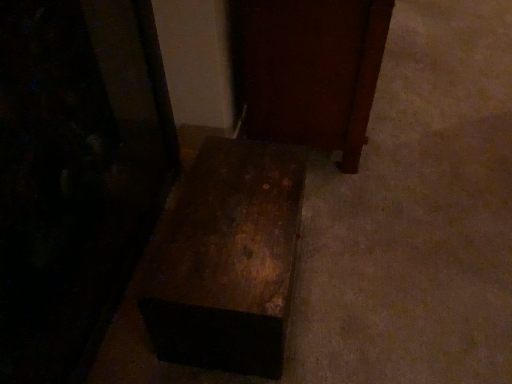
You are a GUI agent. You are given a task and a screenshot of the screen. Output one action in this format:
    pyautogui.click(x=<x>, y=<y>)
    Task: Click on the rusty wood trunk at center, arranged as the second furniture when viewed from the right
    This screenshot has width=512, height=384.
    Given the screenshot: What is the action you would take?
    pyautogui.click(x=227, y=260)

From the picture: Measure the distance between point (210, 346) and camera.

3.39 feet.

I want to click on dark wood door at center, which appears as the 3th furniture when viewed from the left, so click(x=312, y=71).

Measure the distance between rusty metal box at lower center, the 1th furniture from the left, and camera.

rusty metal box at lower center, the 1th furniture from the left, and camera are 3.44 feet apart from each other.

Find the location of `rusty wood trunk at center, placed as the second furniture when sorted from left to right`. rusty wood trunk at center, placed as the second furniture when sorted from left to right is located at coordinates 227,260.

How different are the orientations of rusty wood trunk at center, arranged as the second furniture when viewed from the right, and dark wood door at center, which appears as the 3th furniture when viewed from the left, in degrees?

0.917 degrees separate the facing orientations of rusty wood trunk at center, arranged as the second furniture when viewed from the right, and dark wood door at center, which appears as the 3th furniture when viewed from the left.

In the scene shown: Does rusty wood trunk at center, arranged as the second furniture when viewed from the right, appear on the left side of dark wood door at center, marked as the 1th furniture in a right-to-left arrangement?

Correct, you'll find rusty wood trunk at center, arranged as the second furniture when viewed from the right, to the left of dark wood door at center, marked as the 1th furniture in a right-to-left arrangement.

Does rusty wood trunk at center, arranged as the second furniture when viewed from the right, have a lesser width compared to dark wood door at center, which appears as the 3th furniture when viewed from the left?

Indeed, rusty wood trunk at center, arranged as the second furniture when viewed from the right, has a lesser width compared to dark wood door at center, which appears as the 3th furniture when viewed from the left.

In terms of size, does rusty wood trunk at center, arranged as the second furniture when viewed from the right, appear bigger or smaller than dark wood door at center, marked as the 1th furniture in a right-to-left arrangement?

In the image, rusty wood trunk at center, arranged as the second furniture when viewed from the right, appears to be smaller than dark wood door at center, marked as the 1th furniture in a right-to-left arrangement.

Is rusty metal box at lower center, the 1th furniture from the left, at the right side of dark wood door at center, which appears as the 3th furniture when viewed from the left?

No, rusty metal box at lower center, the 1th furniture from the left, is not to the right of dark wood door at center, which appears as the 3th furniture when viewed from the left.

Is rusty metal box at lower center, the third furniture in the right-to-left sequence, not inside dark wood door at center, which appears as the 3th furniture when viewed from the left?

Yes, rusty metal box at lower center, the third furniture in the right-to-left sequence, is not within dark wood door at center, which appears as the 3th furniture when viewed from the left.

Which is in front, point (7, 277) or point (364, 80)?

The point (7, 277) is closer to the camera.

From the image's perspective, is rusty metal box at lower center, the third furniture in the right-to-left sequence, located above or below dark wood door at center, marked as the 1th furniture in a right-to-left arrangement?

rusty metal box at lower center, the third furniture in the right-to-left sequence, is below dark wood door at center, marked as the 1th furniture in a right-to-left arrangement.

From the image's perspective, would you say rusty wood trunk at center, arranged as the second furniture when viewed from the right, is positioned over rusty metal box at lower center, the third furniture in the right-to-left sequence?

No, from the image's perspective, rusty wood trunk at center, arranged as the second furniture when viewed from the right, is not on top of rusty metal box at lower center, the third furniture in the right-to-left sequence.

Which is more distant, (225, 297) or (58, 231)?

The point (58, 231) is farther.

Which of these two, rusty wood trunk at center, placed as the second furniture when sorted from left to right, or rusty metal box at lower center, the 1th furniture from the left, stands shorter?

With less height is rusty wood trunk at center, placed as the second furniture when sorted from left to right.

Between rusty wood trunk at center, placed as the second furniture when sorted from left to right, and rusty metal box at lower center, the third furniture in the right-to-left sequence, which one appears on the left side from the viewer's perspective?

rusty metal box at lower center, the third furniture in the right-to-left sequence, is more to the left.

Is dark wood door at center, marked as the 1th furniture in a right-to-left arrangement, turned away from rusty metal box at lower center, the 1th furniture from the left?

No.

From a real-world perspective, between dark wood door at center, which appears as the 3th furniture when viewed from the left, and rusty metal box at lower center, the third furniture in the right-to-left sequence, who is vertically higher?

In real-world perspective, rusty metal box at lower center, the third furniture in the right-to-left sequence, is above.

Which object is closer to the camera taking this photo, dark wood door at center, marked as the 1th furniture in a right-to-left arrangement, or rusty metal box at lower center, the third furniture in the right-to-left sequence?

rusty metal box at lower center, the third furniture in the right-to-left sequence, is more forward.

Is dark wood door at center, which appears as the 3th furniture when viewed from the left, spatially inside rusty metal box at lower center, the third furniture in the right-to-left sequence, or outside of it?

dark wood door at center, which appears as the 3th furniture when viewed from the left, is not enclosed by rusty metal box at lower center, the third furniture in the right-to-left sequence.

Between rusty metal box at lower center, the third furniture in the right-to-left sequence, and rusty wood trunk at center, arranged as the second furniture when viewed from the right, which one is positioned in front?

rusty metal box at lower center, the third furniture in the right-to-left sequence.

Looking at this image, in terms of size, does rusty metal box at lower center, the third furniture in the right-to-left sequence, appear bigger or smaller than rusty wood trunk at center, arranged as the second furniture when viewed from the right?

rusty metal box at lower center, the third furniture in the right-to-left sequence, is bigger than rusty wood trunk at center, arranged as the second furniture when viewed from the right.

Considering the sizes of objects rusty metal box at lower center, the 1th furniture from the left, and rusty wood trunk at center, placed as the second furniture when sorted from left to right, in the image provided, who is wider, rusty metal box at lower center, the 1th furniture from the left, or rusty wood trunk at center, placed as the second furniture when sorted from left to right,?

With larger width is rusty wood trunk at center, placed as the second furniture when sorted from left to right.

Is rusty metal box at lower center, the 1th furniture from the left, not inside rusty wood trunk at center, placed as the second furniture when sorted from left to right?

rusty metal box at lower center, the 1th furniture from the left, lies outside rusty wood trunk at center, placed as the second furniture when sorted from left to right,'s area.

Does dark wood door at center, which appears as the 3th furniture when viewed from the left, appear on the right side of rusty wood trunk at center, placed as the second furniture when sorted from left to right?

Yes, dark wood door at center, which appears as the 3th furniture when viewed from the left, is to the right of rusty wood trunk at center, placed as the second furniture when sorted from left to right.

Considering the relative sizes of dark wood door at center, marked as the 1th furniture in a right-to-left arrangement, and rusty wood trunk at center, placed as the second furniture when sorted from left to right, in the image provided, is dark wood door at center, marked as the 1th furniture in a right-to-left arrangement, wider than rusty wood trunk at center, placed as the second furniture when sorted from left to right,?

Yes.

Who is more distant, dark wood door at center, marked as the 1th furniture in a right-to-left arrangement, or rusty wood trunk at center, arranged as the second furniture when viewed from the right?

dark wood door at center, marked as the 1th furniture in a right-to-left arrangement, is further away from the camera.

Does dark wood door at center, which appears as the 3th furniture when viewed from the left, turn towards rusty wood trunk at center, placed as the second furniture when sorted from left to right?

No, dark wood door at center, which appears as the 3th furniture when viewed from the left, is not aimed at rusty wood trunk at center, placed as the second furniture when sorted from left to right.

What are the coordinates of `the 2nd furniture below when counting from the dark wood door at center, which appears as the 3th furniture when viewed from the left (from the image's perspective)` in the screenshot? It's located at (227, 260).

The height and width of the screenshot is (384, 512). There is a dark wood door at center, which appears as the 3th furniture when viewed from the left. Identify the location of furniture above it (from a real-world perspective). (75, 175).

Based on their spatial positions, is dark wood door at center, which appears as the 3th furniture when viewed from the left, or rusty metal box at lower center, the third furniture in the right-to-left sequence, further from rusty wood trunk at center, placed as the second furniture when sorted from left to right?

dark wood door at center, which appears as the 3th furniture when viewed from the left, is further to rusty wood trunk at center, placed as the second furniture when sorted from left to right.

Considering their positions, is rusty metal box at lower center, the third furniture in the right-to-left sequence, positioned further to dark wood door at center, marked as the 1th furniture in a right-to-left arrangement, than rusty wood trunk at center, placed as the second furniture when sorted from left to right?

Based on the image, rusty metal box at lower center, the third furniture in the right-to-left sequence, appears to be further to dark wood door at center, marked as the 1th furniture in a right-to-left arrangement.

Which object lies nearer to the anchor point rusty wood trunk at center, placed as the second furniture when sorted from left to right, rusty metal box at lower center, the 1th furniture from the left, or dark wood door at center, which appears as the 3th furniture when viewed from the left?

rusty metal box at lower center, the 1th furniture from the left.

From the image, which object appears to be nearer to rusty metal box at lower center, the third furniture in the right-to-left sequence, rusty wood trunk at center, placed as the second furniture when sorted from left to right, or dark wood door at center, which appears as the 3th furniture when viewed from the left?

rusty wood trunk at center, placed as the second furniture when sorted from left to right.

When comparing their distances from rusty metal box at lower center, the third furniture in the right-to-left sequence, does dark wood door at center, marked as the 1th furniture in a right-to-left arrangement, or rusty wood trunk at center, placed as the second furniture when sorted from left to right, seem further?

Based on the image, dark wood door at center, marked as the 1th furniture in a right-to-left arrangement, appears to be further to rusty metal box at lower center, the third furniture in the right-to-left sequence.

Based on their spatial positions, is rusty wood trunk at center, arranged as the second furniture when viewed from the right, or rusty metal box at lower center, the 1th furniture from the left, further from dark wood door at center, marked as the 1th furniture in a right-to-left arrangement?

rusty metal box at lower center, the 1th furniture from the left, lies further to dark wood door at center, marked as the 1th furniture in a right-to-left arrangement, than the other object.

Locate an element on the screen. This screenshot has height=384, width=512. furniture between dark wood door at center, marked as the 1th furniture in a right-to-left arrangement, and rusty wood trunk at center, arranged as the second furniture when viewed from the right, in the vertical direction is located at coordinates (75, 175).